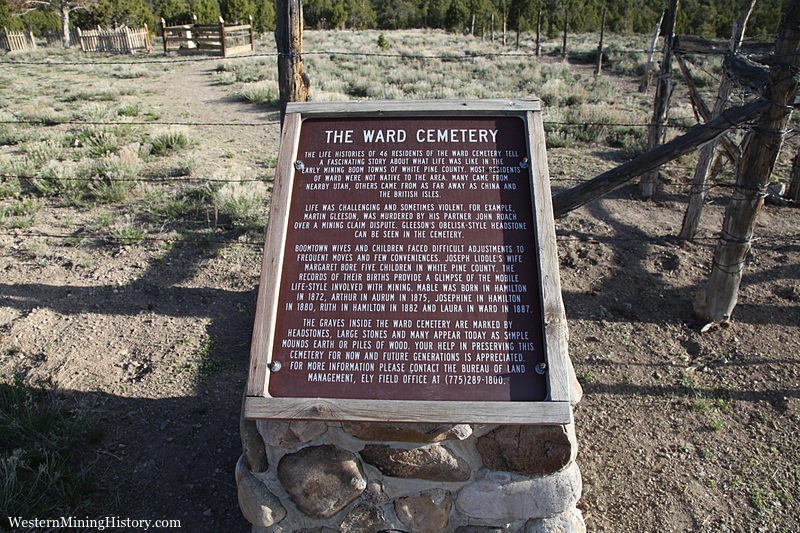
Where is `frame`? The image size is (800, 533). frame is located at coordinates (550, 330).